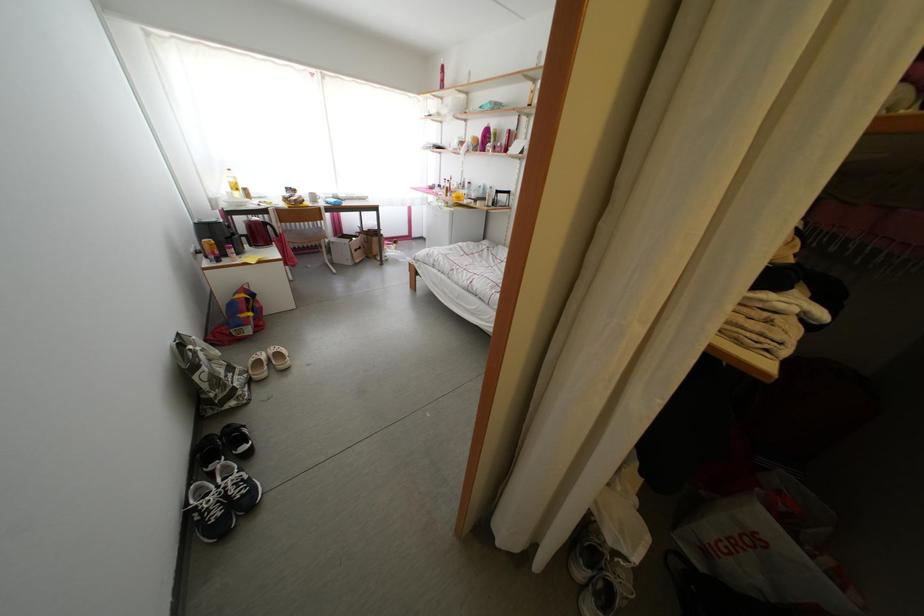
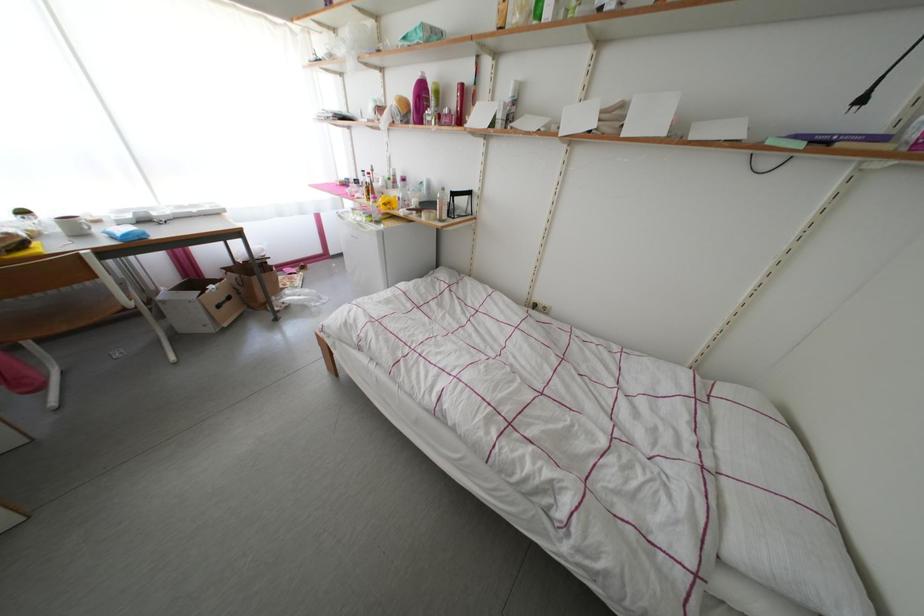
Question: Which direction would the cameraman need to move to produce the second image? Reply with the corresponding letter.

Choices:
 (A) Left
 (B) Right
 (C) Forward
 (D) Backward

Answer: (C)